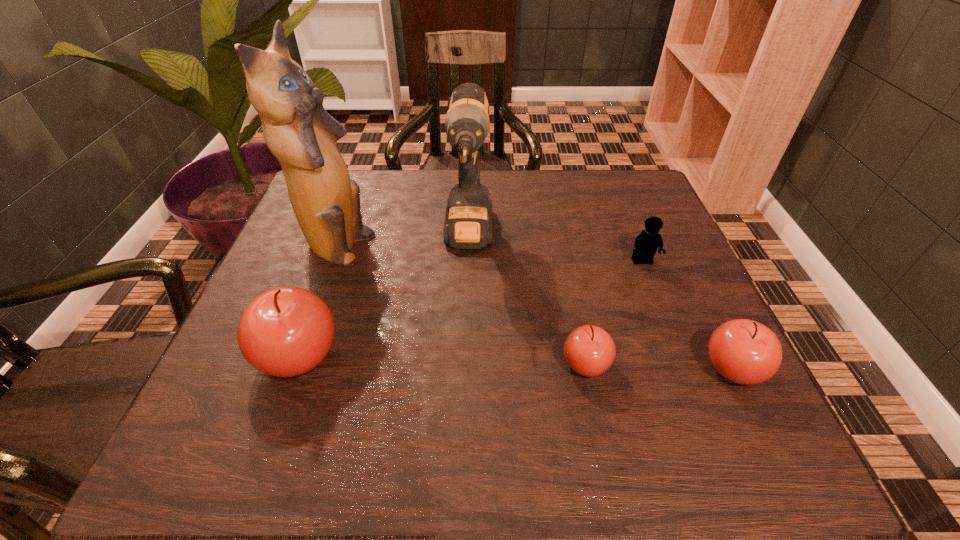
Locate an element on the screen. The height and width of the screenshot is (540, 960). free space that is in between the drill and the second shortest apple is located at coordinates (601, 303).

Locate an element on the screen. The width and height of the screenshot is (960, 540). free space between the Lego and the third tallest object is located at coordinates (470, 308).

Identify the location of vacant space that's between the leftmost apple and the rightmost apple. The height and width of the screenshot is (540, 960). coord(516,362).

You are a GUI agent. You are given a task and a screenshot of the screen. Output one action in this format:
    pyautogui.click(x=<x>, y=<y>)
    Task: Click on the empty space between the shortest apple and the cat
    
    Given the screenshot: What is the action you would take?
    pyautogui.click(x=461, y=307)

Where is `unoccupied position between the cat and the fourth object from left to right`? unoccupied position between the cat and the fourth object from left to right is located at coordinates (461, 307).

Where is `unoccupied position between the drill and the Lego`? This screenshot has width=960, height=540. unoccupied position between the drill and the Lego is located at coordinates (556, 249).

Select which object appears as the second closest to the cat. Please provide its 2D coordinates. Your answer should be formatted as a tuple, i.e. [(x, y)], where the tuple contains the x and y coordinates of a point satisfying the conditions above.

[(468, 221)]

You are a GUI agent. You are given a task and a screenshot of the screen. Output one action in this format:
    pyautogui.click(x=<x>, y=<y>)
    Task: Click on the object that is the fifth closest to the third tallest object
    The width and height of the screenshot is (960, 540).
    Given the screenshot: What is the action you would take?
    pyautogui.click(x=743, y=351)

At what (x,y) coordinates should I click in order to perform the action: click on apple that is the closest to the fifth shortest object. Please return your answer as a coordinate pair (x, y). Image resolution: width=960 pixels, height=540 pixels. Looking at the image, I should click on (287, 331).

Identify which apple is the second closest to the rightmost apple. Please provide its 2D coordinates. Your answer should be formatted as a tuple, i.e. [(x, y)], where the tuple contains the x and y coordinates of a point satisfying the conditions above.

[(287, 331)]